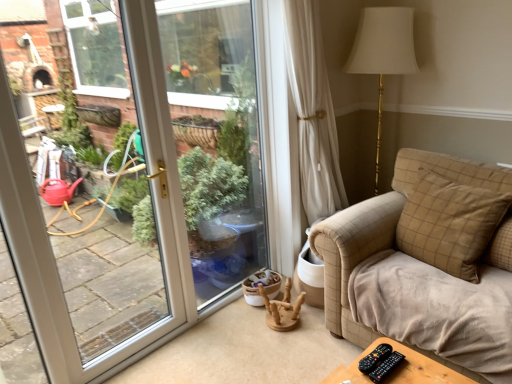
Image resolution: width=512 pixels, height=384 pixels. What are the coordinates of `free space in front of wooden at center` in the screenshot? It's located at (289, 350).